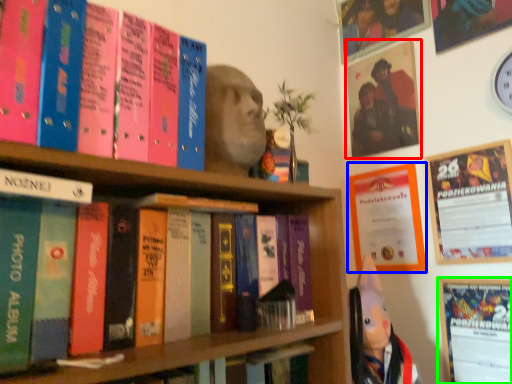
Question: Which object is positioned closest to picture frame (highlighted by a red box)? Select from poster page (highlighted by a blue box) and bulletin board (highlighted by a green box).

Choices:
 (A) poster page
 (B) bulletin board

Answer: (A)